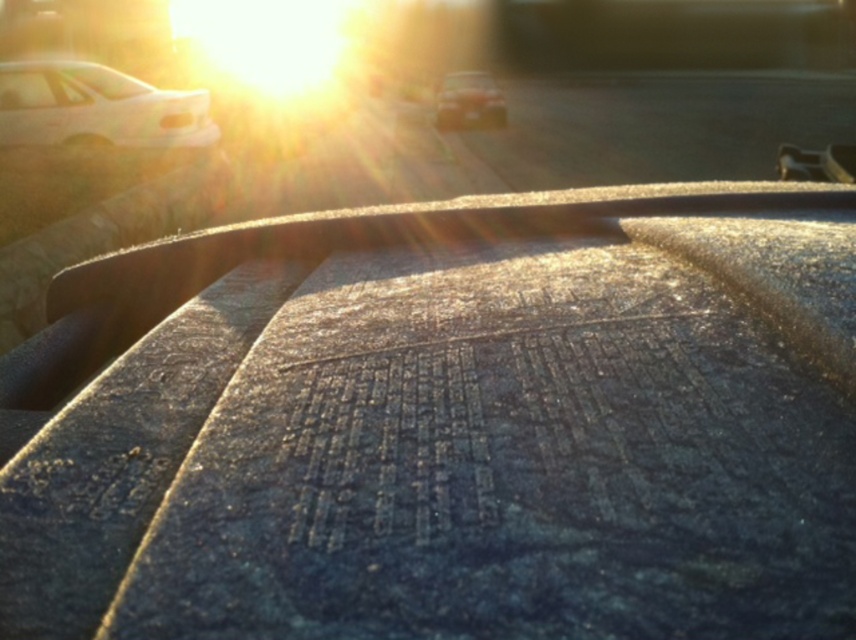
Identify the location of white matte car at left. The height and width of the screenshot is (640, 856). (94, 116).

Can you confirm if white matte car at left is positioned to the left of metallic silver car at center?

Correct, you'll find white matte car at left to the left of metallic silver car at center.

The image size is (856, 640). What are the coordinates of `white matte car at left` in the screenshot? It's located at (94, 116).

This screenshot has width=856, height=640. I want to click on white matte car at left, so click(x=94, y=116).